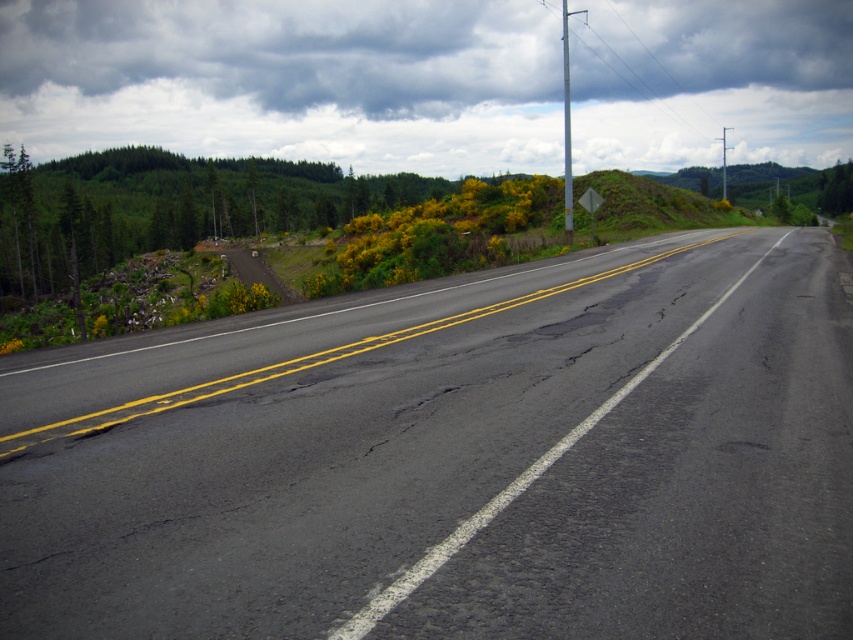
You are a driver approaching the intersection and see the black asphalt road at center and the cloudy sky at upper center. Which object appears larger in the image?

The cloudy sky at upper center appears larger than the black asphalt road at center in the image.

You are a driver approaching the black asphalt road at center and the cloudy sky at upper center. Which one will you see first as you drive forward?

The black asphalt road at center will be seen first because it is closer to the viewer compared to the cloudy sky at upper center, which is further away.